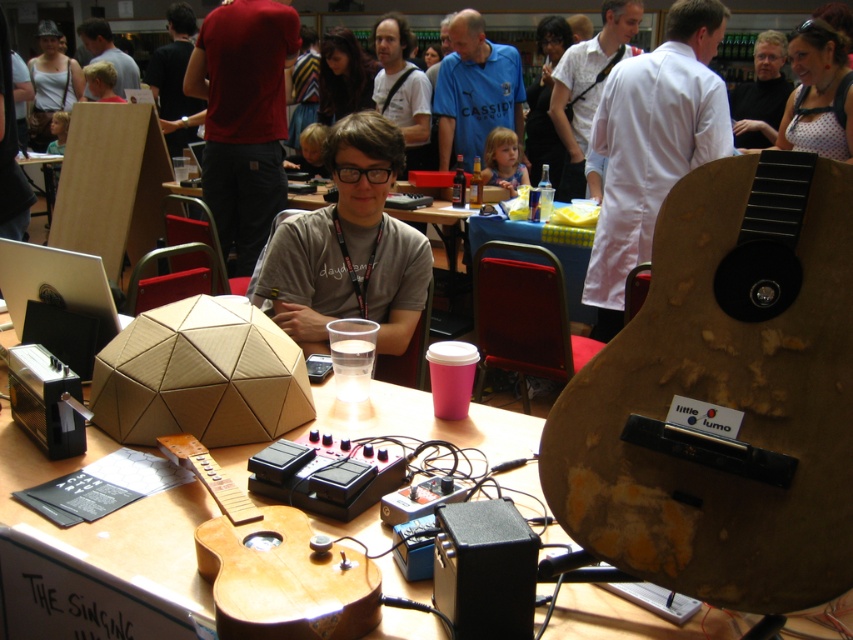
You are a photographer standing in the workshop and want to take a photo that includes both the wooden acoustic guitar at center and the blonde hair at upper left. Which object will appear larger in the photo?

The wooden acoustic guitar at center will appear larger in the photo because it is closer to the viewer than the blonde hair at upper left.

In the scene shown: You are standing at the camera position and want to reach the point marked as point [357,563]. If your stride length is 28 inches, how many steps do you need to take to reach that point?

The distance between you and point [357,563] is 38.43 inches. Since each step covers 28 inches, you would need to take 2 steps to cover the distance. However, since 2 steps would only cover 56 inches, which exceeds the required distance, you might need to adjust your last step to land precisely at the point. Alternatively, rounding up, you would take 2 full steps and then a smaller step. But strictly mathematically, dividing 38.43 by 28 gives approximately 1.37 steps. Since you can only take whole steps,

You are an event organizer who needs to set up a photo shoot in this workshop. You must place a large banner between the wooden acoustic guitar at center and the blue jersey at center. Based on their positions, where should the banner be placed?

The wooden acoustic guitar at center is below the blue jersey at center, so the banner should be placed above the wooden acoustic guitar at center and below the blue jersey at center to position it between them.